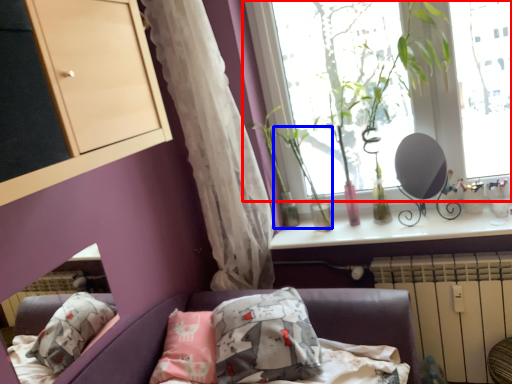
Question: Which object appears closest to the camera in this image, window (highlighted by a red box) or plant (highlighted by a blue box)?

Choices:
 (A) window
 (B) plant

Answer: (A)